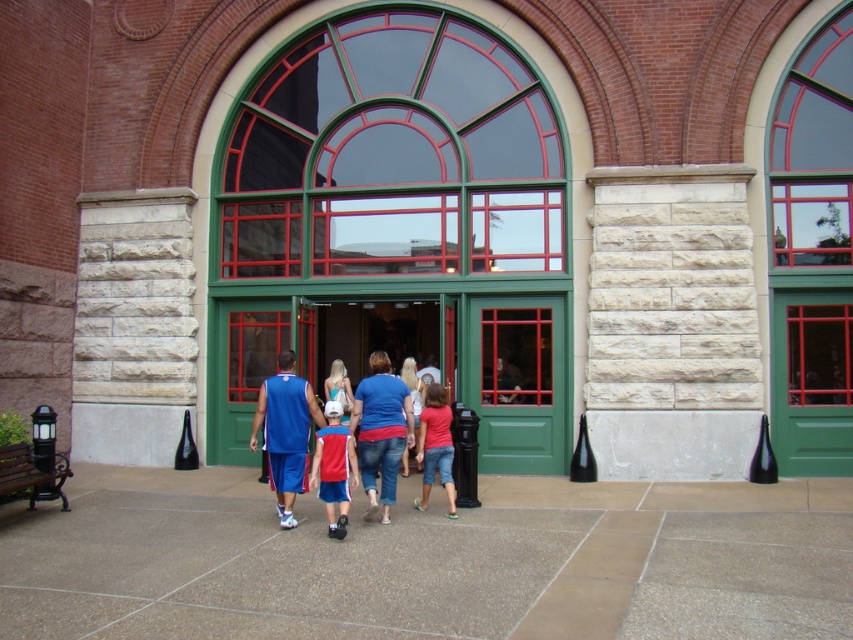
Question: Is brown polished concrete pavement at center thinner than denim shorts at center?

Choices:
 (A) yes
 (B) no

Answer: (B)

Question: Which point is farther to the camera?

Choices:
 (A) green glass window at upper center
 (B) matte red shirt at center
 (C) blue denim jeans at center
 (D) brown polished concrete pavement at center

Answer: (A)

Question: Which of the following is the closest to the observer?

Choices:
 (A) (817, 589)
 (B) (373, 440)

Answer: (A)

Question: Is blue jersey at center above blue fabric shirt at center?

Choices:
 (A) no
 (B) yes

Answer: (A)

Question: Which of the following is the farthest from the observer?

Choices:
 (A) (347, 412)
 (B) (802, 563)
 (C) (816, 451)
 (D) (343, 506)

Answer: (A)

Question: Is green glass doors at center to the left of green glass window at upper center from the viewer's perspective?

Choices:
 (A) no
 (B) yes

Answer: (B)